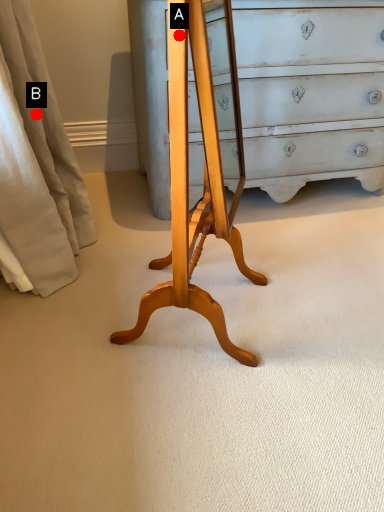
Question: Two points are circled on the image, labeled by A and B beside each circle. Which point is closer to the camera?

Choices:
 (A) A is closer
 (B) B is closer

Answer: (A)